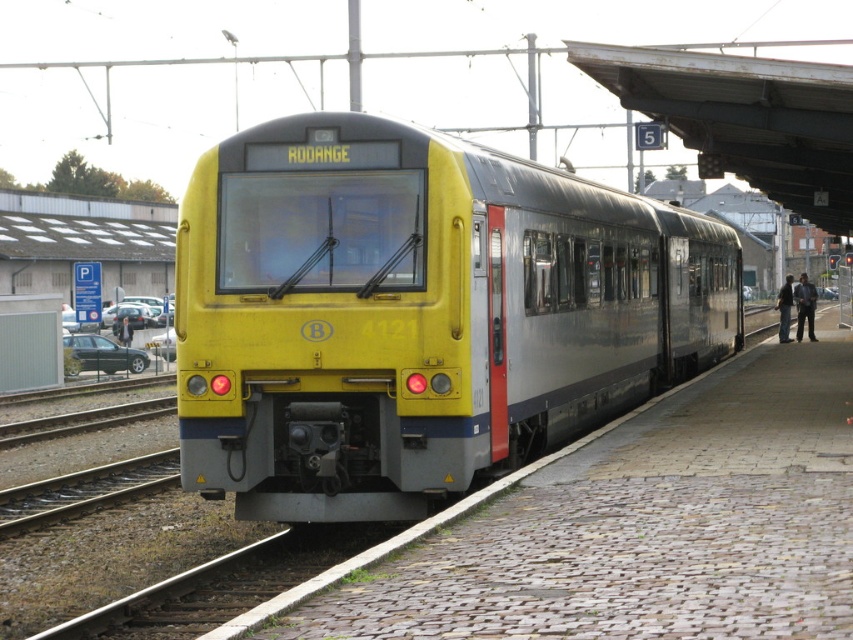
You are a passenger waiting at the station. You need to board the yellow matte train at center. Where should you go on the cobblestone platform at center to find the entrance?

The yellow matte train at center is positioned on the left side of the cobblestone platform at center, so you should go to the left side of the cobblestone platform at center to find the entrance.

You are a photographer standing on the cobblestone platform at center. You want to take a photo of the yellow matte train at center so that both the train and the platform are clearly visible in the frame. Considering their sizes, will you need to adjust your camera angle to include both?

The yellow matte train at center is larger in size than the cobblestone platform at center. To include both in the frame, you would need to adjust your camera angle to accommodate the train being bigger, possibly by moving back or using a wider lens.

You are standing at the point marked as point (418, 314). What is the object located exactly at this point?

The yellow matte train at center is located exactly at point (418, 314).